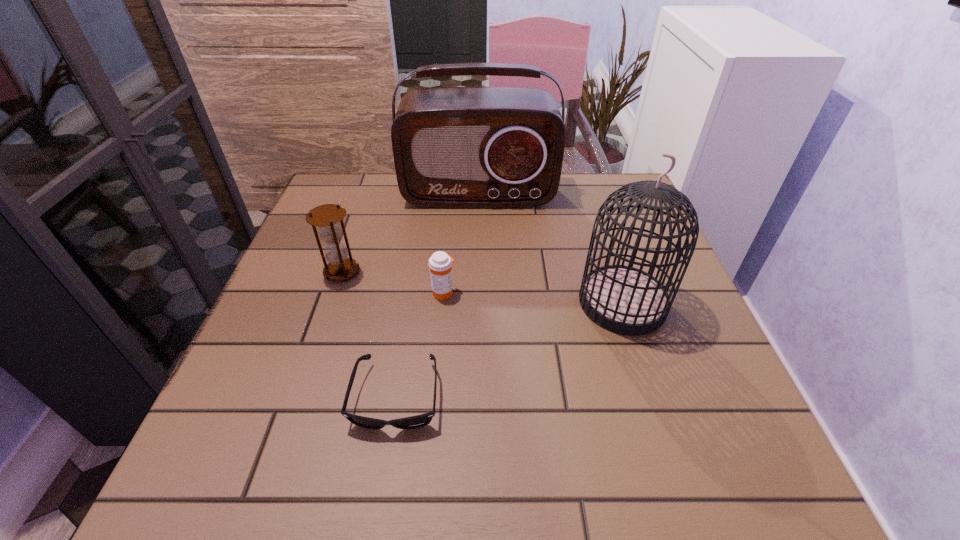
This screenshot has width=960, height=540. I want to click on vacant space at the far right corner of the desktop, so click(588, 209).

Where is `blank region between the fourth tallest object and the shortest object`? Image resolution: width=960 pixels, height=540 pixels. blank region between the fourth tallest object and the shortest object is located at coordinates (420, 345).

The height and width of the screenshot is (540, 960). I want to click on free space that is in between the birdcage and the third shortest object, so click(482, 287).

Where is `free spot between the radio receiver and the birdcage`? The height and width of the screenshot is (540, 960). free spot between the radio receiver and the birdcage is located at coordinates (550, 249).

Find the location of `vacant space that is in between the second shortest object and the shortest object`. vacant space that is in between the second shortest object and the shortest object is located at coordinates (420, 345).

The image size is (960, 540). Find the location of `empty location between the third tallest object and the shortest object`. empty location between the third tallest object and the shortest object is located at coordinates (370, 334).

I want to click on free space between the birdcage and the hourglass, so coord(482,287).

Where is `free space between the nearest object and the birdcage`? Image resolution: width=960 pixels, height=540 pixels. free space between the nearest object and the birdcage is located at coordinates (510, 349).

Identify the location of vacant point located between the nearest object and the birdcage. This screenshot has height=540, width=960. (x=510, y=349).

At what (x,y) coordinates should I click in order to perform the action: click on free space between the birdcage and the leftmost object. Please return your answer as a coordinate pair (x, y). The width and height of the screenshot is (960, 540). Looking at the image, I should click on (482, 287).